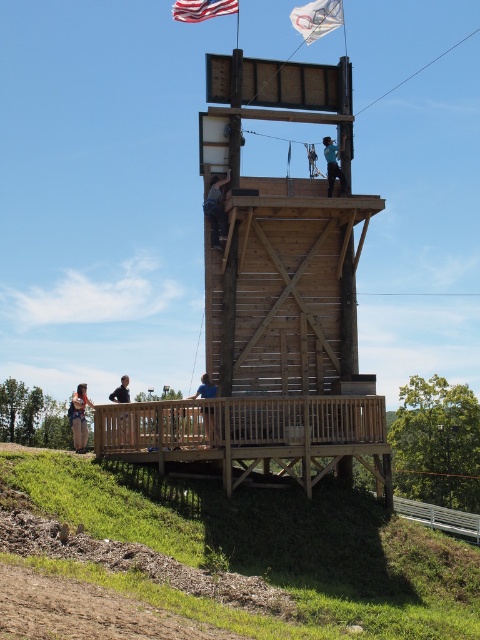
Question: Estimate the real-world distances between objects in this image. Which object is closer to the white plastic flag at upper center?

Choices:
 (A) wooden observation tower at center
 (B) american flag at upper center
 (C) blue denim shirt at center

Answer: (B)

Question: Is green grass at lower left wider than denim jacket at lower left?

Choices:
 (A) no
 (B) yes

Answer: (B)

Question: Which is farther from the denim jacket at lower left?

Choices:
 (A) wooden observation tower at center
 (B) green grass at lower left
 (C) white plastic flag at upper center
 (D) blue denim shirt at center

Answer: (C)

Question: Is blue denim shirt at center positioned behind blue shirt at lower center?

Choices:
 (A) no
 (B) yes

Answer: (B)

Question: Which object appears closest to the camera in this image?

Choices:
 (A) american flag at upper center
 (B) blue fabric shirt at center

Answer: (B)

Question: Is american flag at upper center smaller than blue fabric at upper center?

Choices:
 (A) yes
 (B) no

Answer: (B)